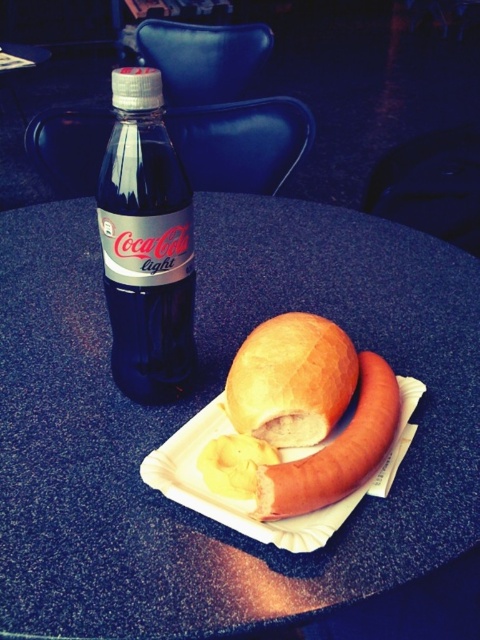
In the scene shown: You are sitting at the blue speckled table at center and want to reach for the white paper plate at center. Which direction should you move to get closer to the plate?

Since the blue speckled table at center is closer to the viewer than the white paper plate at center, you should move backward to get closer to the plate.

You are setting up a small table for a picnic and have a blue glass bottle at left and a slightly toasted bread at center. Which item takes up more horizontal space on the table?

The blue glass bottle at left might be wider than slightly toasted bread at center, so it likely occupies more horizontal space on the table.

You are a waiter in a busy restaurant. You need to place a customer order on the table. The order includes a golden matte roll at center. Where should you place it so it doesn not fall off the blue speckled table at center?

The golden matte roll at center should be placed on the blue speckled table at center since the table is above the roll, ensuring it stays in place and doesn not fall off.